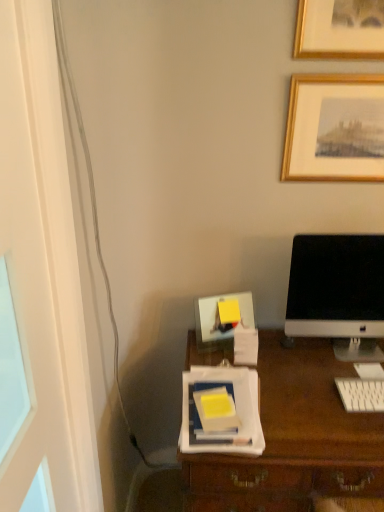
Find the location of `free space to the back side of yellow matte notebook at center`. free space to the back side of yellow matte notebook at center is located at coordinates (220, 373).